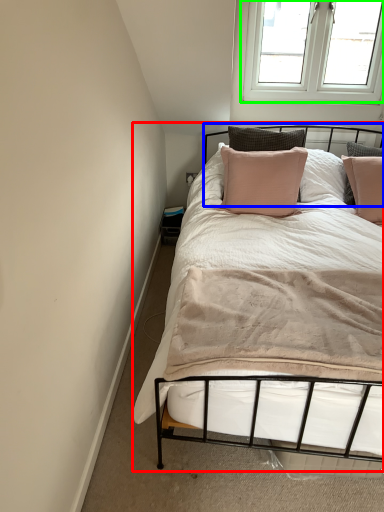
Question: Which object is positioned farthest from bed (highlighted by a red box)? Select from headboard (highlighted by a blue box) and window (highlighted by a green box).

Choices:
 (A) headboard
 (B) window

Answer: (A)